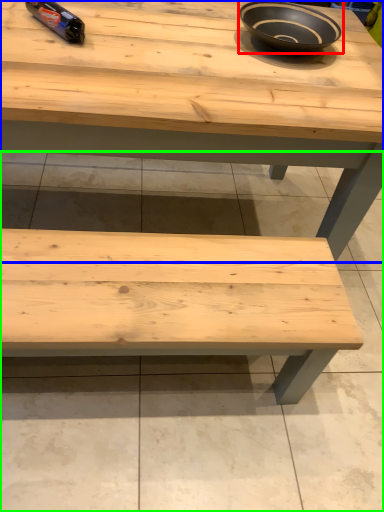
Question: Which is farther away from bowl (highlighted by a red box)? table (highlighted by a blue box) or concrete (highlighted by a green box)?

Choices:
 (A) table
 (B) concrete

Answer: (B)